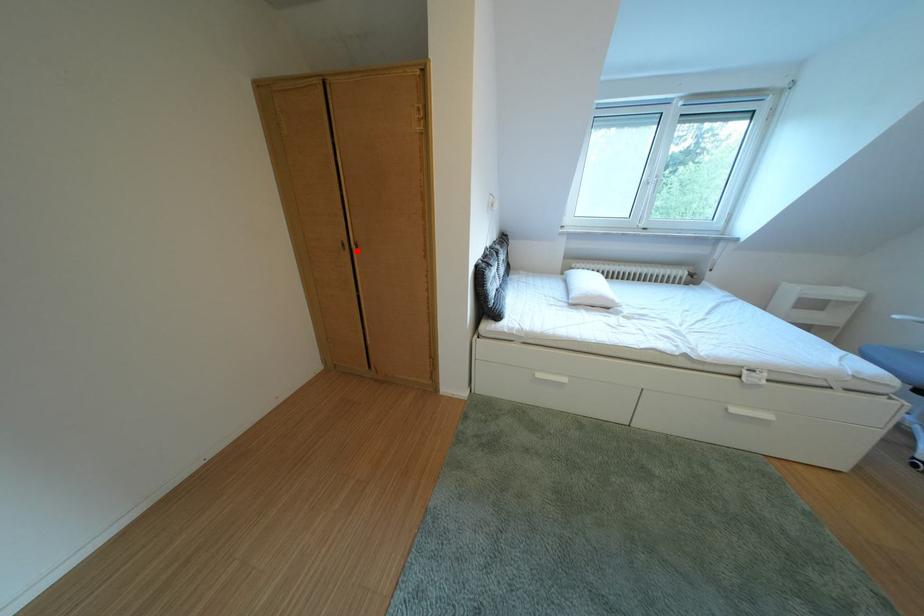
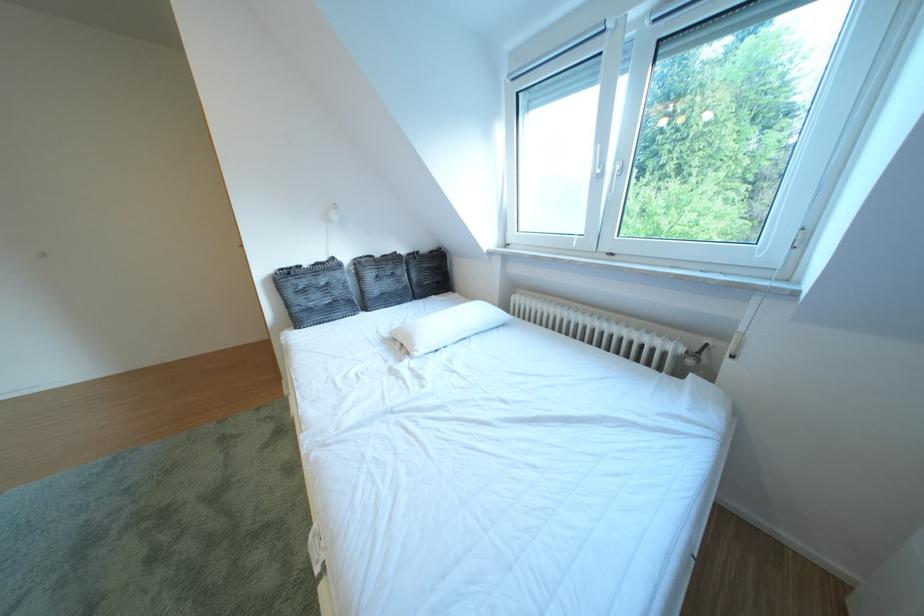
Question: I am providing you with two images of the same scene from different viewpoints. A red point is marked on the first image. Can you still see the location of the red point in image 2?

Choices:
 (A) Yes
 (B) No

Answer: (B)